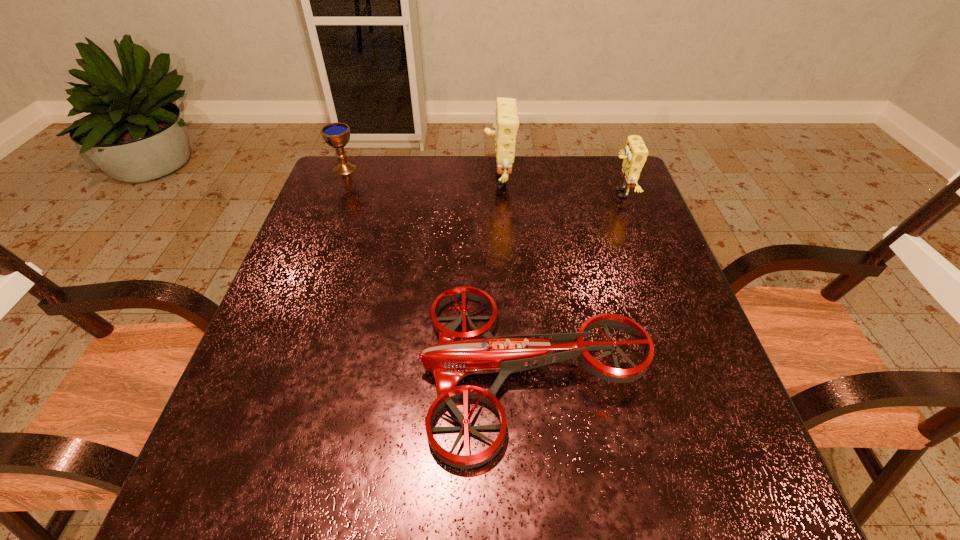
At what (x,y) coordinates should I click in order to perform the action: click on drone situated at the right edge. Please return your answer as a coordinate pair (x, y). Looking at the image, I should click on (458, 354).

The width and height of the screenshot is (960, 540). I want to click on object present at the far left corner, so click(337, 135).

Where is `object located at the far right corner`? object located at the far right corner is located at coordinates (635, 154).

Image resolution: width=960 pixels, height=540 pixels. In order to click on object that is at the near right corner in this screenshot , I will do `click(458, 354)`.

The width and height of the screenshot is (960, 540). In the image, there is a desktop. Identify the location of vacant space at the far edge. (444, 159).

This screenshot has height=540, width=960. In order to click on vacant space at the near edge in this screenshot , I will do `click(340, 480)`.

In the image, there is a desktop. Where is `vacant space at the left edge`? vacant space at the left edge is located at coordinates (301, 333).

In the image, there is a desktop. At what (x,y) coordinates should I click in order to perform the action: click on vacant space at the right edge. Please return your answer as a coordinate pair (x, y). The width and height of the screenshot is (960, 540). Looking at the image, I should click on (709, 359).

Locate an element on the screen. free area in between the third tallest object and the drone is located at coordinates (439, 269).

Where is `vacant point located between the shortest object and the chalice`? vacant point located between the shortest object and the chalice is located at coordinates (439, 269).